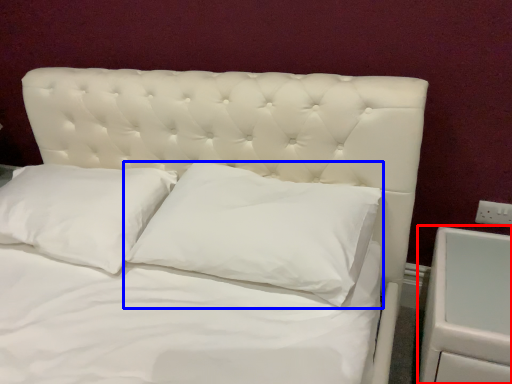
Question: Which of the following is the closest to the observer, dresser (highlighted by a red box) or pillow (highlighted by a blue box)?

Choices:
 (A) dresser
 (B) pillow

Answer: (A)